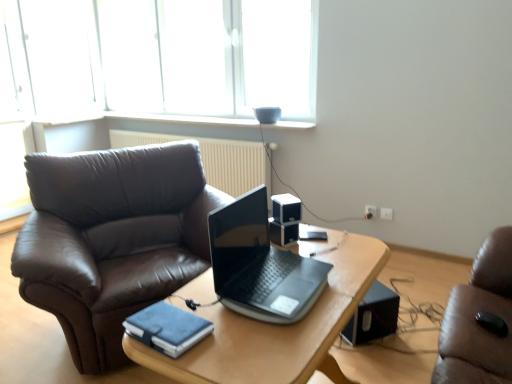
Question: Which direction should I rotate to look at white plastic speaker at center, the first loudspeaker in the left-to-right sequence?

Choices:
 (A) left
 (B) right

Answer: (B)

Question: Should I look upward or downward to see white plastic power outlet at right, arranged as the second power outlet when viewed from the right?

Choices:
 (A) up
 (B) down

Answer: (B)

Question: From the image's perspective, would you say beige textured radiator at upper center is positioned over black plastic speaker at center, the second loudspeaker when ordered from front to back?

Choices:
 (A) yes
 (B) no

Answer: (A)

Question: Is the position of beige textured radiator at upper center more distant than that of black plastic speaker at center, the second loudspeaker when ordered from top to bottom?

Choices:
 (A) no
 (B) yes

Answer: (B)

Question: Is beige textured radiator at upper center to the right of black plastic speaker at center, the second loudspeaker when ordered from front to back, from the viewer's perspective?

Choices:
 (A) yes
 (B) no

Answer: (B)

Question: Is beige textured radiator at upper center not inside black plastic speaker at center, positioned as the second loudspeaker in left-to-right order?

Choices:
 (A) yes
 (B) no

Answer: (A)

Question: From the image's perspective, is beige textured radiator at upper center under black plastic speaker at center, positioned as the 2th loudspeaker in bottom-to-top order?

Choices:
 (A) no
 (B) yes

Answer: (A)

Question: Considering the relative sizes of beige textured radiator at upper center and black plastic speaker at center, acting as the 2th loudspeaker starting from the right, in the image provided, is beige textured radiator at upper center thinner than black plastic speaker at center, acting as the 2th loudspeaker starting from the right,?

Choices:
 (A) no
 (B) yes

Answer: (A)

Question: Is white plastic power outlet at right, placed as the 1th power outlet when sorted from left to right, facing away from beige textured radiator at upper center?

Choices:
 (A) no
 (B) yes

Answer: (A)

Question: From the image's perspective, is white plastic power outlet at right, placed as the 1th power outlet when sorted from left to right, located above beige textured radiator at upper center?

Choices:
 (A) yes
 (B) no

Answer: (B)

Question: Can you confirm if white plastic power outlet at right, arranged as the second power outlet when viewed from the right, is taller than beige textured radiator at upper center?

Choices:
 (A) yes
 (B) no

Answer: (B)

Question: From a real-world perspective, is white plastic power outlet at right, arranged as the second power outlet when viewed from the right, beneath beige textured radiator at upper center?

Choices:
 (A) yes
 (B) no

Answer: (A)

Question: Can you confirm if white plastic power outlet at right, arranged as the second power outlet when viewed from the right, is wider than beige textured radiator at upper center?

Choices:
 (A) yes
 (B) no

Answer: (B)

Question: Is white plastic power outlet at right, arranged as the second power outlet when viewed from the right, outside of beige textured radiator at upper center?

Choices:
 (A) no
 (B) yes

Answer: (B)

Question: Considering the relative positions of black plastic speaker at center, positioned as the 2th loudspeaker in bottom-to-top order, and black plastic speaker at lower right, the 1th loudspeaker viewed from the back, in the image provided, is black plastic speaker at center, positioned as the 2th loudspeaker in bottom-to-top order, behind black plastic speaker at lower right, the 1th loudspeaker viewed from the back,?

Choices:
 (A) yes
 (B) no

Answer: (B)